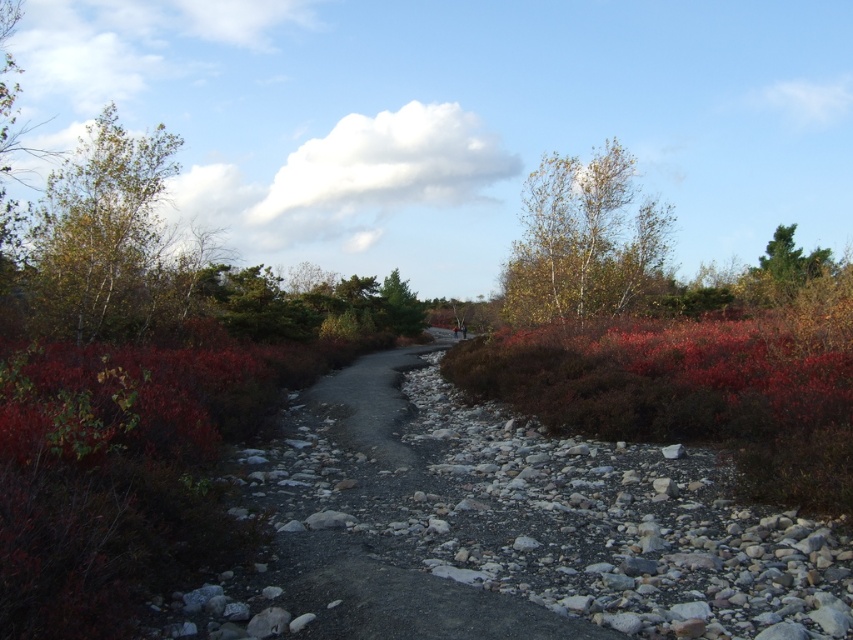
Which of these two, green leafy tree at upper left or green leafy tree at upper right, stands taller?

With more height is green leafy tree at upper left.

Can you confirm if green leafy tree at upper left is bigger than green leafy tree at upper right?

Correct, green leafy tree at upper left is larger in size than green leafy tree at upper right.

This screenshot has width=853, height=640. I want to click on green leafy tree at upper left, so [x=102, y=236].

At what (x,y) coordinates should I click in order to perform the action: click on green leafy tree at upper left. Please return your answer as a coordinate pair (x, y). Looking at the image, I should click on (102, 236).

I want to click on green leafy tree at upper left, so click(102, 236).

Where is `green leafy tree at upper left`? The image size is (853, 640). green leafy tree at upper left is located at coordinates (102, 236).

Which is below, green leafy tree at upper right or green matte tree at center?

green matte tree at center is lower down.

Is green leafy tree at upper right to the left of green matte tree at center from the viewer's perspective?

In fact, green leafy tree at upper right is to the right of green matte tree at center.

Which is in front, point (561, 291) or point (408, 333)?

Point (561, 291)

Locate an element on the screen. The image size is (853, 640). green leafy tree at upper right is located at coordinates (584, 241).